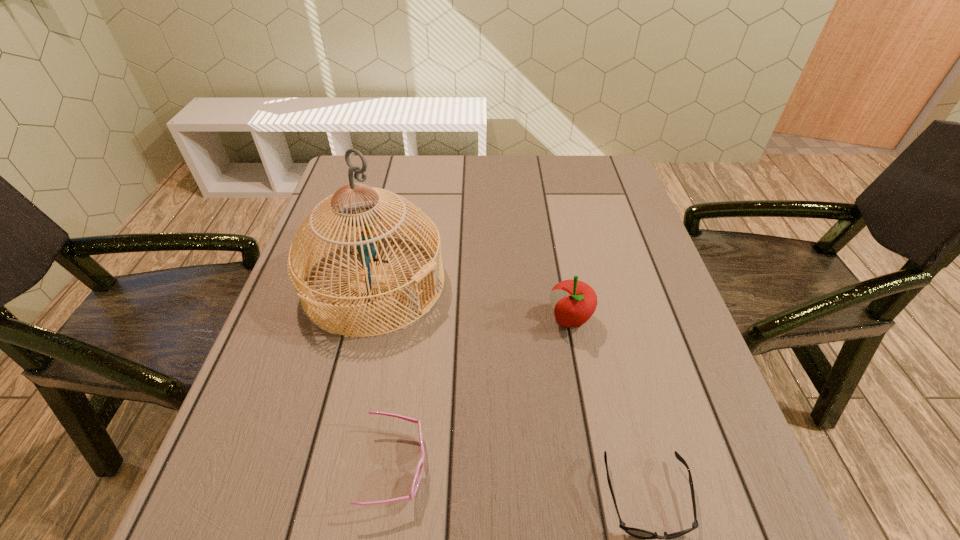
The width and height of the screenshot is (960, 540). What are the coordinates of `birdcage` in the screenshot? It's located at (358, 214).

You are a GUI agent. You are given a task and a screenshot of the screen. Output one action in this format:
    pyautogui.click(x=<x>, y=<y>)
    Task: Click on the second tallest object
    Image resolution: width=960 pixels, height=540 pixels.
    Given the screenshot: What is the action you would take?
    pyautogui.click(x=574, y=302)

Where is `the taller sunglasses`? The height and width of the screenshot is (540, 960). the taller sunglasses is located at coordinates (417, 477).

In order to click on the left sunglasses in this screenshot , I will do `click(417, 477)`.

The height and width of the screenshot is (540, 960). Find the location of `free location located 0.080m on the right of the birdcage`. free location located 0.080m on the right of the birdcage is located at coordinates (479, 282).

Find the location of `free space located 0.350m on the front of the second tallest object`. free space located 0.350m on the front of the second tallest object is located at coordinates (607, 522).

At what (x,y) coordinates should I click in order to perform the action: click on blank space located 0.380m on the front-facing side of the taller sunglasses. Please return your answer as a coordinate pair (x, y). This screenshot has width=960, height=540. Looking at the image, I should click on (656, 467).

Identify the location of object that is at the near edge. The width and height of the screenshot is (960, 540). (417, 477).

Where is `object that is positioned at the left edge`? object that is positioned at the left edge is located at coordinates (358, 214).

The width and height of the screenshot is (960, 540). I want to click on free spot at the far edge of the desktop, so click(x=499, y=165).